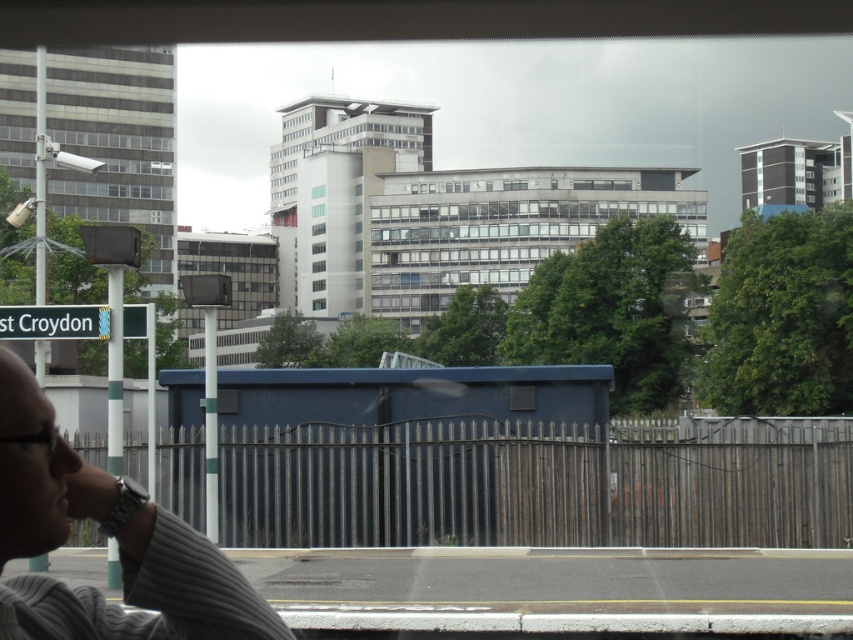
Is gray striped shirt at lower left smaller than white plastic street sign at lower left?

Indeed, gray striped shirt at lower left has a smaller size compared to white plastic street sign at lower left.

Does gray striped shirt at lower left appear on the right side of white plastic street sign at lower left?

Correct, you'll find gray striped shirt at lower left to the right of white plastic street sign at lower left.

Where is `gray striped shirt at lower left`? The image size is (853, 640). gray striped shirt at lower left is located at coordinates (107, 532).

At what (x,y) coordinates should I click in order to perform the action: click on gray striped shirt at lower left. Please return your answer as a coordinate pair (x, y). The height and width of the screenshot is (640, 853). Looking at the image, I should click on (107, 532).

Who is shorter, blue metallic bus stop at center or gray striped shirt at lower left?

With less height is gray striped shirt at lower left.

The height and width of the screenshot is (640, 853). What do you see at coordinates (415, 456) in the screenshot? I see `blue metallic bus stop at center` at bounding box center [415, 456].

Who is more distant from viewer, (x=250, y=385) or (x=38, y=440)?

The point (x=250, y=385) is more distant.

The height and width of the screenshot is (640, 853). I want to click on blue metallic bus stop at center, so click(x=415, y=456).

This screenshot has width=853, height=640. What do you see at coordinates (415, 456) in the screenshot?
I see `blue metallic bus stop at center` at bounding box center [415, 456].

The width and height of the screenshot is (853, 640). I want to click on blue metallic bus stop at center, so click(415, 456).